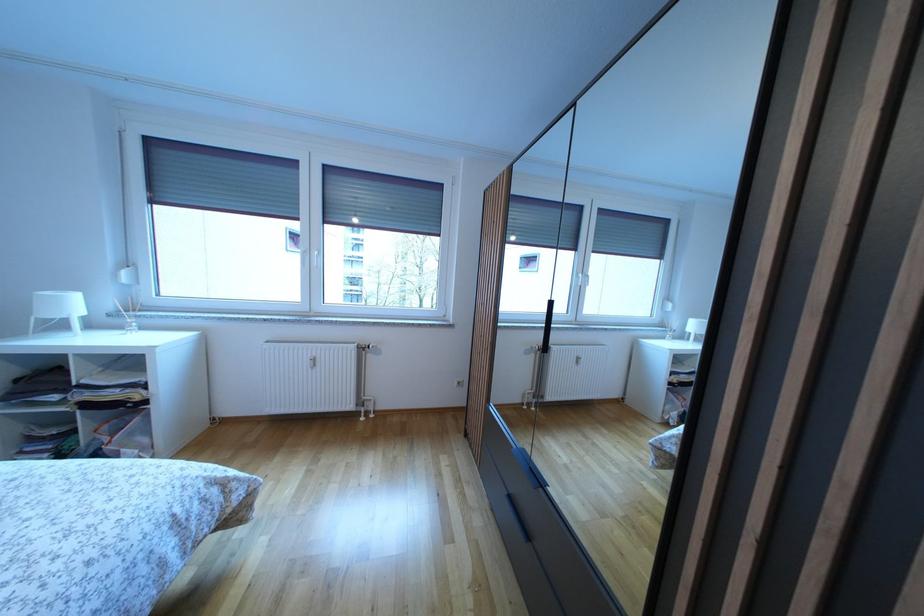
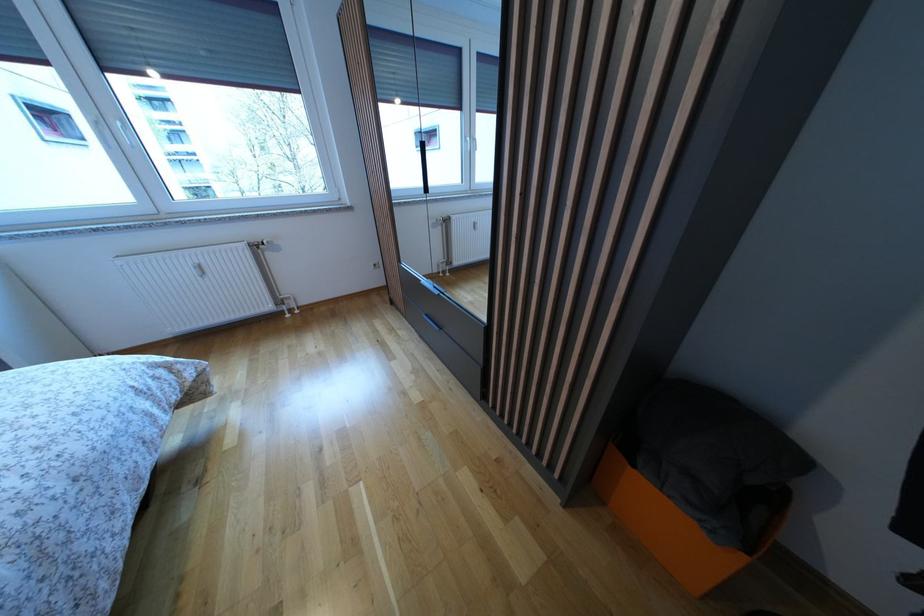
Where in the second image is the point corresponding to point 517,504 from the first image?

(433, 321)